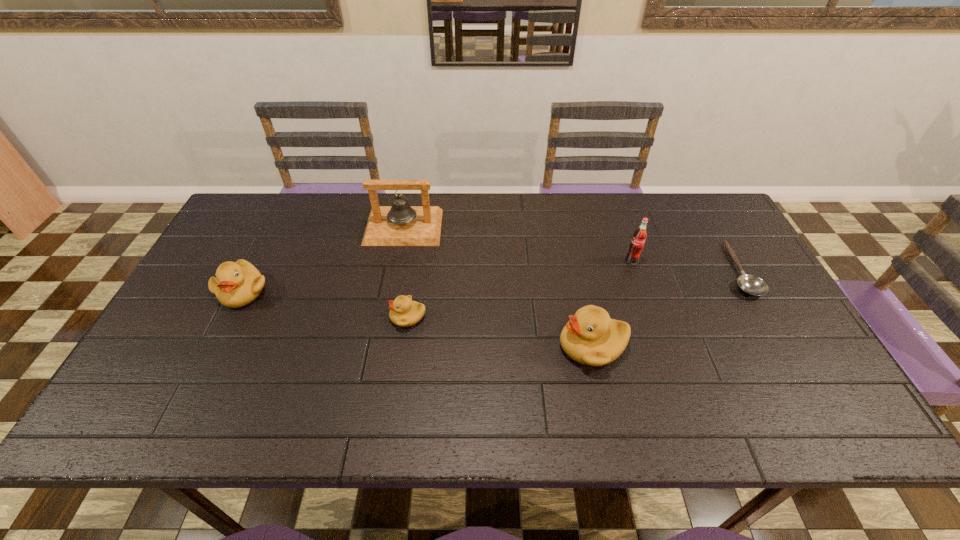
This screenshot has height=540, width=960. I want to click on free space located at the beak of the second duckling from left to right, so click(x=329, y=317).

Locate an element on the screen. free spot located 0.250m at the beak of the second duckling from left to right is located at coordinates (295, 317).

Identify the location of blank space located 0.140m at the beak of the second duckling from left to right. (337, 317).

Where is `free space located 0.370m at the beak of the fourth object from left to right`? The width and height of the screenshot is (960, 540). free space located 0.370m at the beak of the fourth object from left to right is located at coordinates (410, 346).

The image size is (960, 540). Identify the location of free space located 0.330m at the beak of the fourth object from left to right. (425, 346).

Identify the location of free space located at the beak of the fourth object from left to right. This screenshot has width=960, height=540. (506, 346).

Where is `free space located on the label of the soda bottle`? free space located on the label of the soda bottle is located at coordinates (647, 303).

At what (x,y) coordinates should I click in order to perform the action: click on vacant area situated 0.320m on the front of the bell. Please return your answer as a coordinate pair (x, y). The width and height of the screenshot is (960, 540). Looking at the image, I should click on (384, 330).

The image size is (960, 540). I want to click on vacant area situated 0.270m on the left of the ladle, so click(x=631, y=269).

Where is `object that is at the far edge`? The height and width of the screenshot is (540, 960). object that is at the far edge is located at coordinates (400, 224).